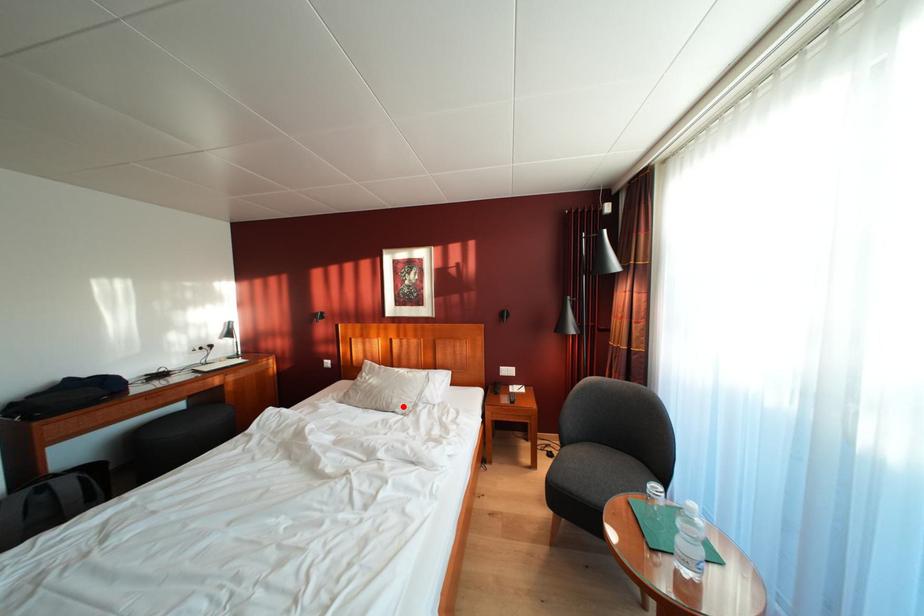
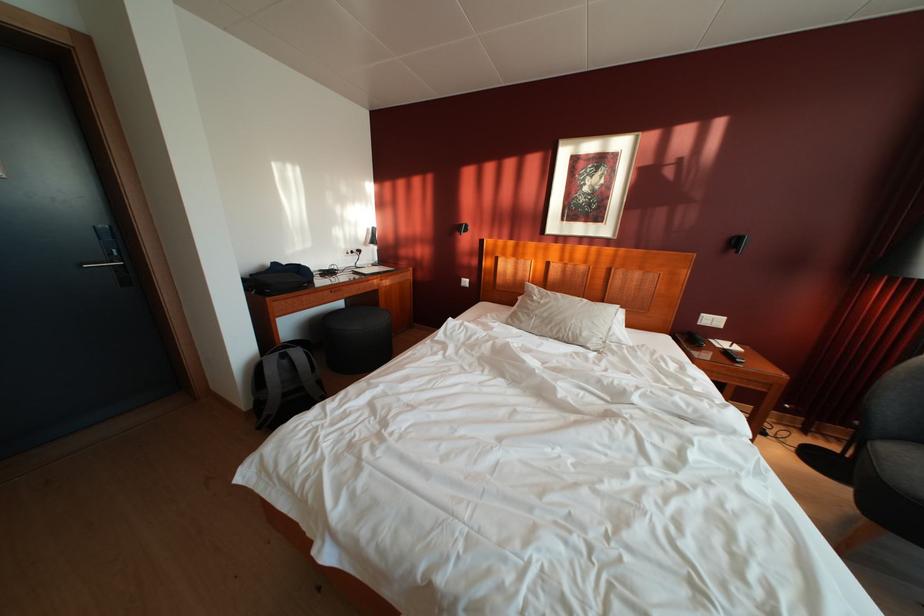
Question: A red point is marked in image1. In image2, is the corresponding 3D point closer to the camera or farther? Reply with the corresponding letter.

Choices:
 (A) The corresponding 3D point is closer.
 (B) The corresponding 3D point is farther.

Answer: (A)